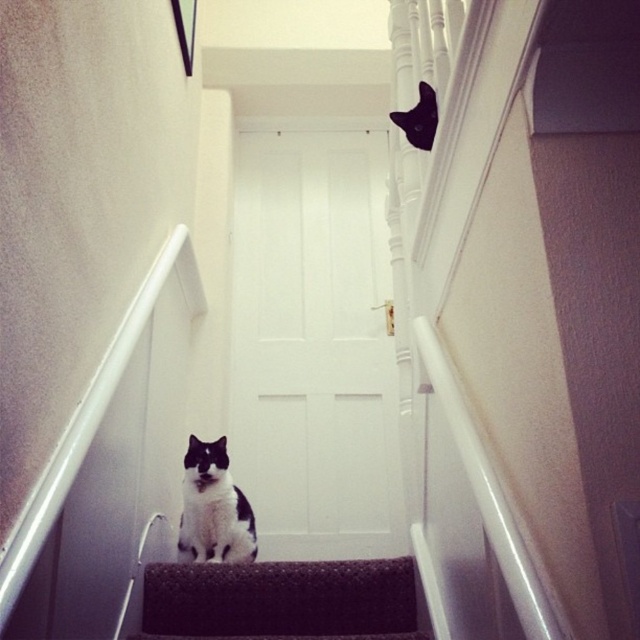
You are standing at the bottom of the dark carpeted stair at center and want to reach the black and white fur cat at center. Which direction should you move to get closer to the cat?

The dark carpeted stair at center is closer to the viewer than the black and white fur cat at center. To reach the cat, you should move upward along the dark carpeted stair at center towards the top of the stairs where the cat is located.

In the scene shown: You are trying to find the black fur cat at upper center. According to the scene, where would you look relative to the dark carpeted stair at center?

The dark carpeted stair at center is below the black fur cat at upper center, so you should look above the dark carpeted stair at center to find the black fur cat at upper center.